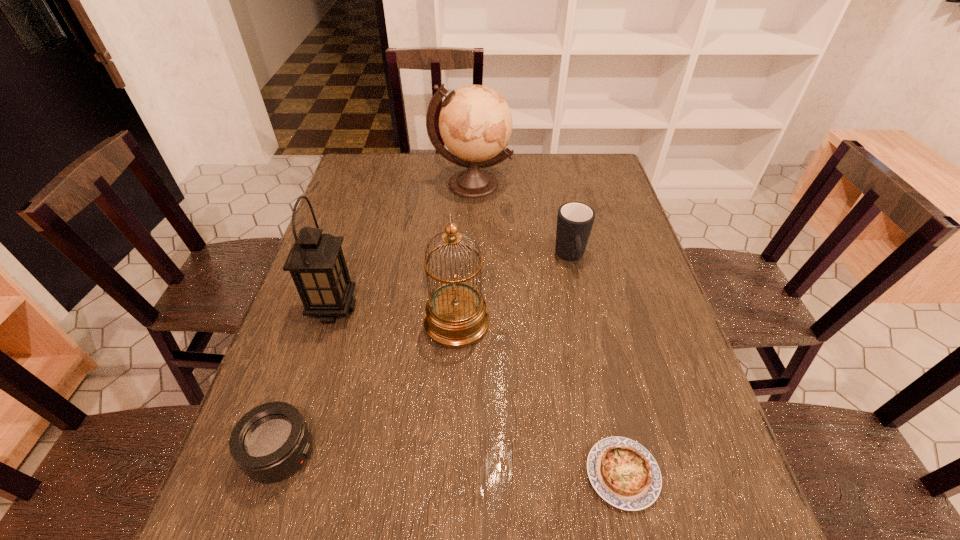
Find the location of a particular element. The height and width of the screenshot is (540, 960). free point located 0.260m on the side of the second farthest object with the handle is located at coordinates (591, 356).

Where is `free space located on the side of the fifth tallest object with brand markings and control switches`? This screenshot has width=960, height=540. free space located on the side of the fifth tallest object with brand markings and control switches is located at coordinates (394, 453).

Where is `free space located 0.280m on the left of the shortest object`? The height and width of the screenshot is (540, 960). free space located 0.280m on the left of the shortest object is located at coordinates (x=435, y=474).

Find the location of a particular element. The width and height of the screenshot is (960, 540). object that is positioned at the far edge is located at coordinates (475, 122).

I want to click on lantern located in the left edge section of the desktop, so click(x=316, y=262).

This screenshot has height=540, width=960. Identify the location of telephoto lens present at the left edge. (272, 441).

The width and height of the screenshot is (960, 540). In order to click on mug that is at the right edge in this screenshot , I will do `click(575, 220)`.

Where is `quiche that is at the right edge`? quiche that is at the right edge is located at coordinates (624, 473).

Identify the location of free point at the far edge. This screenshot has width=960, height=540. (534, 180).

Identify the location of vacant point at the left edge. The height and width of the screenshot is (540, 960). (358, 241).